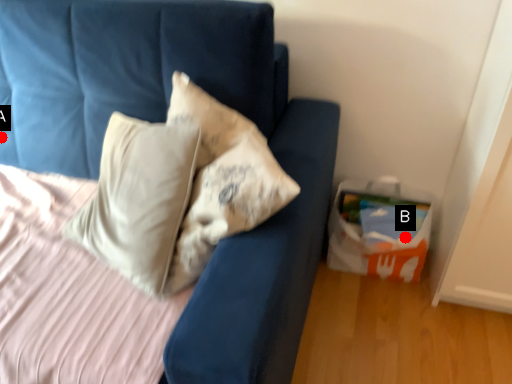
Question: Two points are circled on the image, labeled by A and B beside each circle. Which point is closer to the camera?

Choices:
 (A) A is closer
 (B) B is closer

Answer: (A)